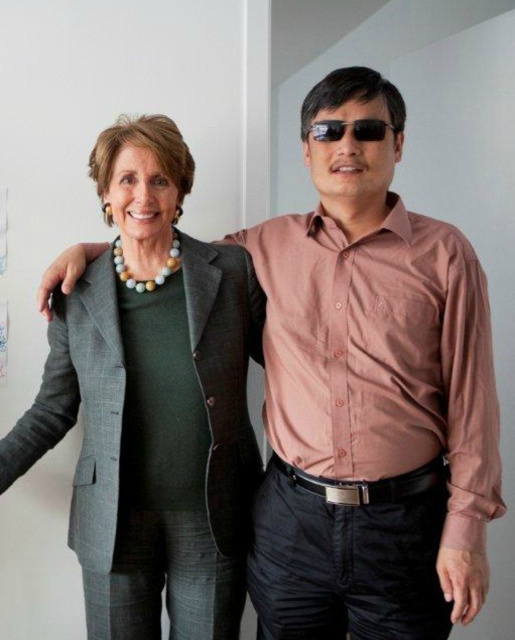
Question: Which object appears farthest from the camera in this image?

Choices:
 (A) black plastic sunglasses at center
 (B) matte gray blazer at center

Answer: (B)

Question: Is matte gray blazer at center wider than black plastic sunglasses at center?

Choices:
 (A) yes
 (B) no

Answer: (A)

Question: Does matte gray blazer at center have a smaller size compared to black plastic sunglasses at center?

Choices:
 (A) no
 (B) yes

Answer: (A)

Question: Can you confirm if matte gray blazer at center is positioned to the left of black plastic sunglasses at center?

Choices:
 (A) yes
 (B) no

Answer: (A)